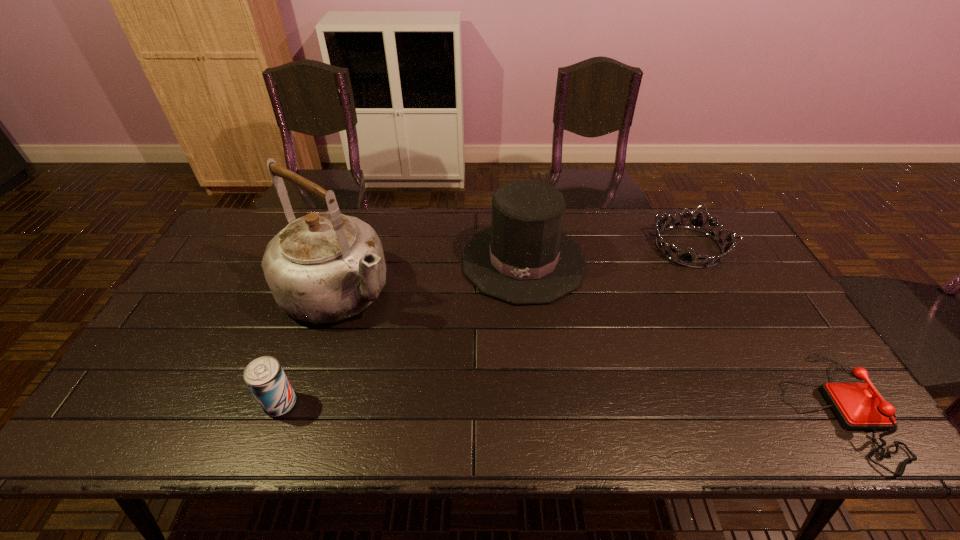
You are a GUI agent. You are given a task and a screenshot of the screen. Output one action in this format:
    pyautogui.click(x=<x>, y=<y>)
    Task: Click on the telephone that is at the right edge
    The height and width of the screenshot is (540, 960).
    Given the screenshot: What is the action you would take?
    pyautogui.click(x=857, y=405)

Identify the location of tiara at the right edge. (685, 259).

Find the location of a particular element. The height and width of the screenshot is (540, 960). object located in the far right corner section of the desktop is located at coordinates (685, 259).

Where is `object located in the near right corner section of the desktop`? This screenshot has height=540, width=960. object located in the near right corner section of the desktop is located at coordinates (857, 405).

At what (x,y) coordinates should I click in order to perform the action: click on free region at the far edge. Please return your answer as a coordinate pair (x, y). This screenshot has height=540, width=960. Looking at the image, I should click on (625, 240).

In the image, there is a desktop. At what (x,y) coordinates should I click in order to perform the action: click on vacant space at the near edge. Please return your answer as a coordinate pair (x, y). The height and width of the screenshot is (540, 960). Looking at the image, I should click on (511, 390).

This screenshot has width=960, height=540. What are the coordinates of `vacant space at the left edge of the desktop` in the screenshot? It's located at (226, 290).

I want to click on vacant space at the far left corner of the desktop, so click(x=246, y=219).

Image resolution: width=960 pixels, height=540 pixels. I want to click on vacant space at the near right corner, so click(806, 403).

You are a GUI agent. You are given a task and a screenshot of the screen. Output one action in this format:
    pyautogui.click(x=<x>, y=<y>)
    Task: Click on the free area in between the tiara and the telephone
    
    Given the screenshot: What is the action you would take?
    pyautogui.click(x=762, y=328)